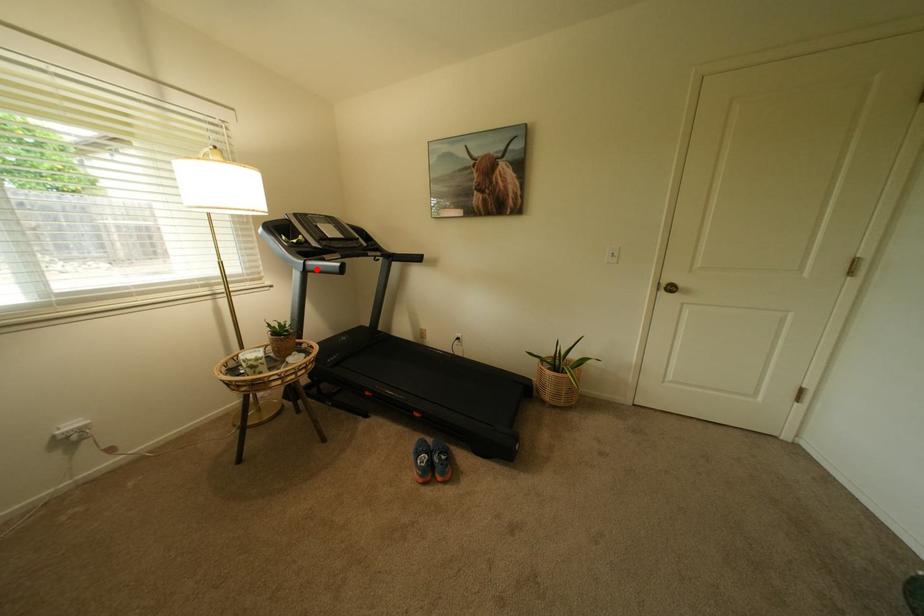
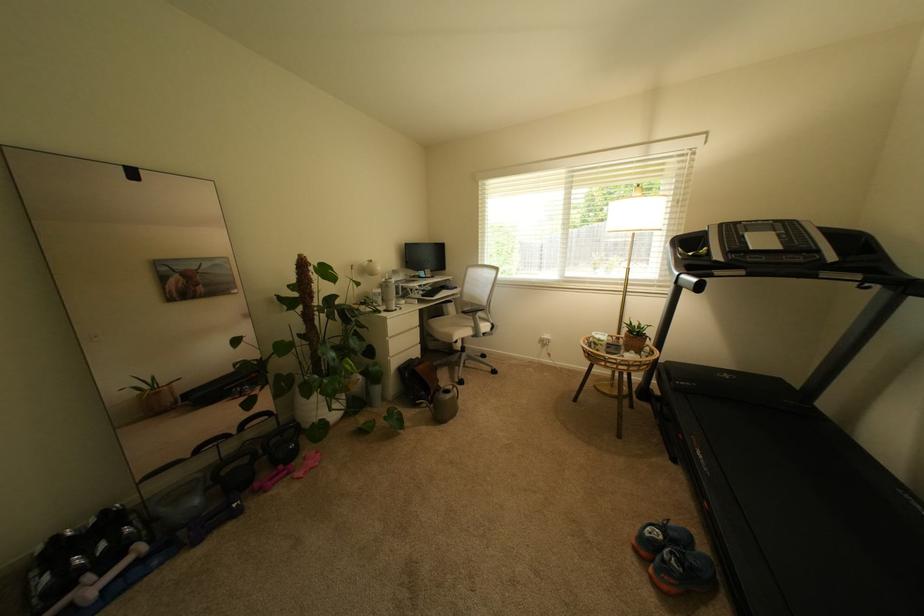
Question: I am providing you with two images of the same scene from different viewpoints. A red point is shown in image1. For the corresponding object point in image2, is it positioned nearer or farther from the camera?

Choices:
 (A) Nearer
 (B) Farther

Answer: (A)